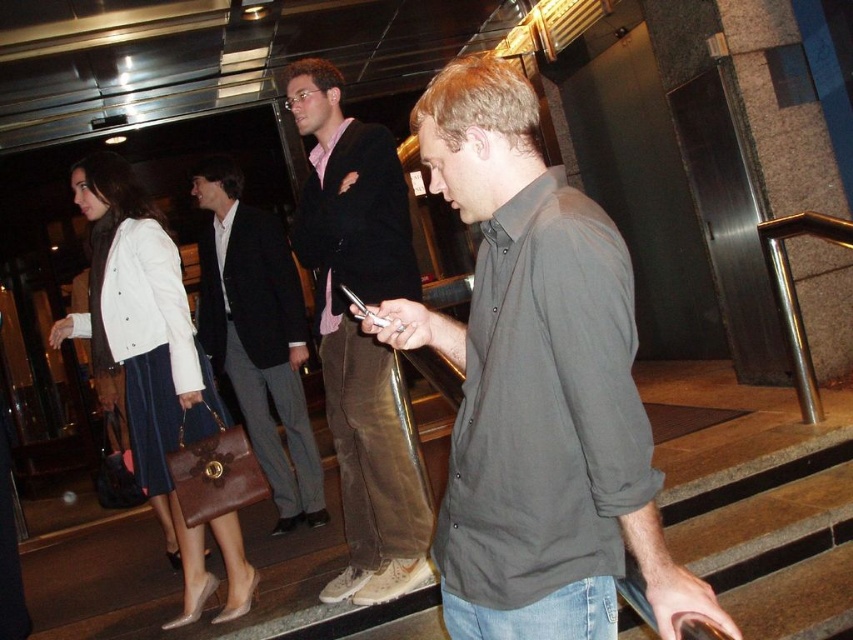
Question: Based on their relative distances, which object is nearer to the dark brown leather briefcase at center?

Choices:
 (A) gray matte shirt at center
 (B) brown suede pants at center
 (C) velvet skirt at center

Answer: (C)

Question: Which point is farther from the camera taking this photo?

Choices:
 (A) (393, 564)
 (B) (207, 275)
 (C) (125, 326)
 (D) (505, 353)

Answer: (B)

Question: In this image, where is brown suede pants at center located relative to velvet skirt at center?

Choices:
 (A) right
 (B) left

Answer: (A)

Question: In this image, where is brown suede pants at center located relative to velvet skirt at center?

Choices:
 (A) above
 (B) below

Answer: (A)

Question: Which point is farther to the camera?

Choices:
 (A) velvet skirt at center
 (B) dark brown leather briefcase at center

Answer: (B)

Question: Can you confirm if velvet skirt at center is smaller than dark brown leather briefcase at center?

Choices:
 (A) no
 (B) yes

Answer: (A)